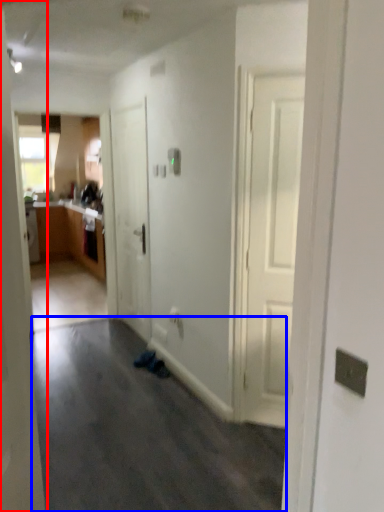
Question: Which of the following is the farthest to the observer, door (highlighted by a red box) or plain (highlighted by a blue box)?

Choices:
 (A) door
 (B) plain

Answer: (B)